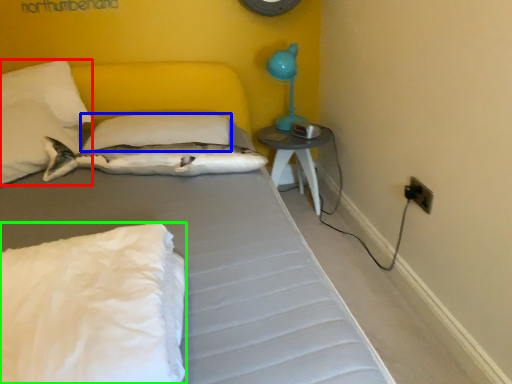
Question: Considering the real-world distances, which object is closest to pillow (highlighted by a red box)? pillow (highlighted by a blue box) or pillow (highlighted by a green box).

Choices:
 (A) pillow
 (B) pillow

Answer: (A)